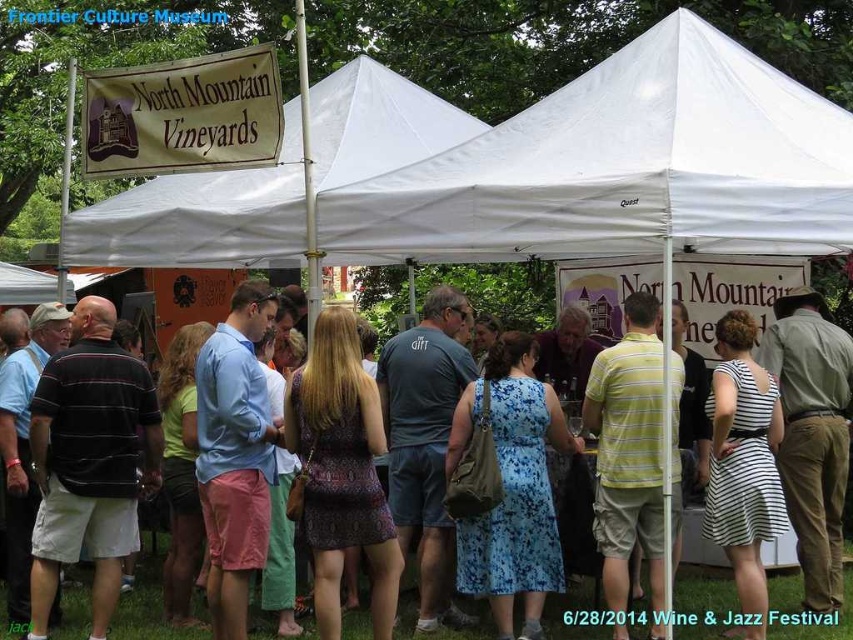
Question: Is white fabric canopy at center positioned in front of floral dress at center?

Choices:
 (A) no
 (B) yes

Answer: (B)

Question: Which of these objects is positioned farthest from the floral dress at center?

Choices:
 (A) white fabric canopy at upper center
 (B) white fabric canopy at center

Answer: (A)

Question: Can you confirm if white fabric canopy at center is wider than floral dress at center?

Choices:
 (A) no
 (B) yes

Answer: (B)

Question: Which point is farther from the camera taking this photo?

Choices:
 (A) (717, 602)
 (B) (201, 195)
 (C) (645, 218)

Answer: (B)

Question: In this image, where is white fabric canopy at center located relative to floral dress at center?

Choices:
 (A) above
 (B) below

Answer: (A)

Question: Among these objects, which one is nearest to the camera?

Choices:
 (A) white fabric canopy at upper center
 (B) white fabric canopy at center
 (C) floral dress at center

Answer: (B)